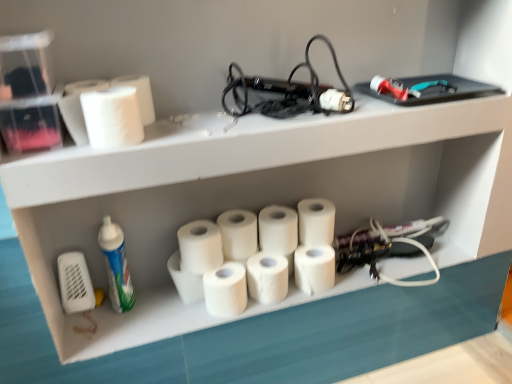
Describe the element at coordinates (78, 107) in the screenshot. This screenshot has height=384, width=512. I see `white matte toilet paper at upper left` at that location.

What do you see at coordinates (238, 234) in the screenshot?
I see `white matte paper towel at center, the 5th paper towel viewed from the right` at bounding box center [238, 234].

Locate an element on the screen. blue-green plastic cleaning product at lower left is located at coordinates (x=116, y=265).

Describe the element at coordinates (112, 117) in the screenshot. I see `white matte paper towel at upper left, which ranks as the 10th paper towel in right-to-left order` at that location.

The image size is (512, 384). Identify the location of white matte paper towel at center, the 5th paper towel from the left. (225, 290).

At what (x,y) coordinates should I click in order to perform the action: click on white matte toilet paper at upper left. Please return your answer as a coordinate pair (x, y). The image size is (512, 384). Looking at the image, I should click on (78, 107).

Is point (275, 293) farther from viewer compared to point (73, 82)?

Yes, point (275, 293) is farther from viewer.

Considering the relative sizes of white matte paper towel at center, the 4th paper towel positioned from the right, and white matte toilet paper at upper left in the image provided, is white matte paper towel at center, the 4th paper towel positioned from the right, smaller than white matte toilet paper at upper left?

Incorrect, white matte paper towel at center, the 4th paper towel positioned from the right, is not smaller in size than white matte toilet paper at upper left.

Do you think white matte paper towel at center, the 4th paper towel positioned from the right, is within white matte toilet paper at upper left, or outside of it?

white matte paper towel at center, the 4th paper towel positioned from the right, is not enclosed by white matte toilet paper at upper left.

There is a white matte toilet paper at upper left. Identify the location of the 7th paper towel below it (from a real-world perspective). (267, 277).

Consider the image. Can you confirm if white matte paper towel at center, the 5th paper towel from the left, is thinner than white matte paper towel at center, which is the 1th paper towel from right to left?

Yes, white matte paper towel at center, the 5th paper towel from the left, is thinner than white matte paper towel at center, which is the 1th paper towel from right to left.

Considering the sizes of objects white matte paper towel at center, the 5th paper towel from the left, and white matte paper towel at center, which is the 1th paper towel from right to left, in the image provided, who is taller, white matte paper towel at center, the 5th paper towel from the left, or white matte paper towel at center, which is the 1th paper towel from right to left,?

white matte paper towel at center, which is the 1th paper towel from right to left.

Is white matte paper towel at center, the 5th paper towel from the left, positioned in front of white matte paper towel at center, which is the 1th paper towel from right to left?

That is True.

Is white matte paper towel at center, which is the 1th paper towel from right to left, at the back of white matte paper towel at center, arranged as the sixth paper towel when viewed from the right?

No, white matte paper towel at center, which is the 1th paper towel from right to left, is not at the back of white matte paper towel at center, arranged as the sixth paper towel when viewed from the right.

Is white matte paper towel at center, the 5th paper towel from the left, to the left of white matte paper towel at center, the 9th paper towel from the left, from the viewer's perspective?

Correct, you'll find white matte paper towel at center, the 5th paper towel from the left, to the left of white matte paper towel at center, the 9th paper towel from the left.

Can you confirm if white matte paper towel at center, the 5th paper towel from the left, is smaller than white matte paper towel at center, the 9th paper towel from the left?

Correct, white matte paper towel at center, the 5th paper towel from the left, occupies less space than white matte paper towel at center, the 9th paper towel from the left.

Could you tell me if white matte paper towel at center, arranged as the sixth paper towel when viewed from the right, is turned towards white matte paper towel at center, which is counted as the 2th paper towel, starting from the right?

No.

Does white matte paper towel at center, arranged as the sixth paper towel when viewed from the right, lie in front of white matte paper towel at center, which is counted as the 2th paper towel, starting from the right?

Yes, white matte paper towel at center, arranged as the sixth paper towel when viewed from the right, is closer to the viewer.

Considering the positions of objects white matte toilet paper at upper left and white matte paper towel at center, the third paper towel when ordered from left to right, in the image provided, who is more to the left, white matte toilet paper at upper left or white matte paper towel at center, the third paper towel when ordered from left to right,?

From the viewer's perspective, white matte toilet paper at upper left appears more on the left side.

Are white matte toilet paper at upper left and white matte paper towel at center, the third paper towel when ordered from left to right, located far from each other?

No, there isn't a large distance between white matte toilet paper at upper left and white matte paper towel at center, the third paper towel when ordered from left to right.

The width and height of the screenshot is (512, 384). Find the location of `toilet paper that appears above the white matte paper towel at center, the third paper towel when ordered from left to right (from the image's perspective)`. toilet paper that appears above the white matte paper towel at center, the third paper towel when ordered from left to right (from the image's perspective) is located at coordinates (78, 107).

Consider the image. From a real-world perspective, does white matte toilet paper at upper left sit lower than white matte paper towel at center, the third paper towel when ordered from left to right?

No, from a real-world perspective, white matte toilet paper at upper left is not below white matte paper towel at center, the third paper towel when ordered from left to right.

Which of these two, white matte paper towel at upper left, which ranks as the 10th paper towel in right-to-left order, or blue-green plastic cleaning product at lower left, stands shorter?

white matte paper towel at upper left, which ranks as the 10th paper towel in right-to-left order.

What's the angular difference between white matte paper towel at upper left, which ranks as the 10th paper towel in right-to-left order, and blue-green plastic cleaning product at lower left's facing directions?

The angle between the facing direction of white matte paper towel at upper left, which ranks as the 10th paper towel in right-to-left order, and the facing direction of blue-green plastic cleaning product at lower left is 0.00115 degrees.

From the image's perspective, is white matte paper towel at upper left, arranged as the first paper towel when viewed from the left, located above or below blue-green plastic cleaning product at lower left?

Based on their image positions, white matte paper towel at upper left, arranged as the first paper towel when viewed from the left, is located above blue-green plastic cleaning product at lower left.

Is white matte paper towel at upper left, arranged as the first paper towel when viewed from the left, facing away from blue-green plastic cleaning product at lower left?

No, white matte paper towel at upper left, arranged as the first paper towel when viewed from the left,'s orientation is not away from blue-green plastic cleaning product at lower left.

Is white matte paper towel at upper left, which ranks as the 10th paper towel in right-to-left order, not near white matte toilet paper at upper left?

white matte paper towel at upper left, which ranks as the 10th paper towel in right-to-left order, is near white matte toilet paper at upper left, not far away.

Which is closer to the camera, (109, 121) or (79, 93)?

Point (109, 121) appears to be closer to the viewer than point (79, 93).

Which of these two, white matte paper towel at upper left, arranged as the first paper towel when viewed from the left, or white matte toilet paper at upper left, is bigger?

With larger size is white matte paper towel at upper left, arranged as the first paper towel when viewed from the left.

Could you tell me if white matte paper towel at upper left, which ranks as the 10th paper towel in right-to-left order, is turned towards white matte toilet paper at upper left?

No, white matte paper towel at upper left, which ranks as the 10th paper towel in right-to-left order, is not aimed at white matte toilet paper at upper left.

What's the angular difference between white matte toilet paper at upper left and white matte paper towel at center, the 5th paper towel from the left,'s facing directions?

The angular difference between white matte toilet paper at upper left and white matte paper towel at center, the 5th paper towel from the left, is 6.83e-05 degrees.

Identify the location of toilet paper lying in front of the white matte paper towel at center, the 5th paper towel from the left. (78, 107).

From a real-world perspective, between white matte toilet paper at upper left and white matte paper towel at center, arranged as the sixth paper towel when viewed from the right, who is vertically higher?

white matte toilet paper at upper left is physically above.

Looking at this image, is white matte toilet paper at upper left surrounding white matte paper towel at center, the 5th paper towel from the left?

No, white matte toilet paper at upper left does not contain white matte paper towel at center, the 5th paper towel from the left.

Starting from the white matte toilet paper at upper left, which paper towel is the 7th one to the right? Please provide its 2D coordinates.

[(267, 277)]

From the image's perspective, count 7th paper towels downward from the white matte paper towel at center, which is counted as the tenth paper towel, starting from the left, and point to it. Please provide its 2D coordinates.

[(225, 290)]

Estimate the real-world distances between objects in this image. Which object is further from white matte paper towel at center, the 5th paper towel from the left, white matte paper towel at center, which is the 1th paper towel from right to left, or blue-green plastic cleaning product at lower left?

white matte paper towel at center, which is the 1th paper towel from right to left, is positioned further to the anchor white matte paper towel at center, the 5th paper towel from the left.

Estimate the real-world distances between objects in this image. Which object is further from white matte paper towel at center, which appears as the eighth paper towel when viewed from the left, white matte paper towel at center, the 9th paper towel from the left, or white matte paper towel at center, which is counted as the tenth paper towel, starting from the left?

white matte paper towel at center, the 9th paper towel from the left, is further to white matte paper towel at center, which appears as the eighth paper towel when viewed from the left.

Which object lies further to the anchor point blue-green plastic cleaning product at lower left, white matte paper towel at center, arranged as the sixth paper towel when viewed from the right, or white matte paper towel at center, the third paper towel when ordered from left to right?

white matte paper towel at center, arranged as the sixth paper towel when viewed from the right, is further to blue-green plastic cleaning product at lower left.

Which object lies further to the anchor point white matte paper towel at center, which appears as the eighth paper towel when viewed from the left, white matte paper towel at center, acting as the 7th paper towel starting from the left, or white matte paper towel at center, the third paper towel when ordered from left to right?

white matte paper towel at center, the third paper towel when ordered from left to right.

Considering their positions, is blue-green plastic cleaning product at lower left positioned closer to white matte paper towel at center, which is counted as the 2th paper towel, starting from the right, than white matte paper towel at center, the sixth paper towel when ordered from left to right?

white matte paper towel at center, the sixth paper towel when ordered from left to right, lies closer to white matte paper towel at center, which is counted as the 2th paper towel, starting from the right, than the other object.

From the image, which object appears to be farther from white matte paper towel at upper left, arranged as the first paper towel when viewed from the left, white matte paper towel at center, arranged as the seventh paper towel when viewed from the right, or blue-green plastic cleaning product at lower left?

The object further to white matte paper towel at upper left, arranged as the first paper towel when viewed from the left, is blue-green plastic cleaning product at lower left.

From the image, which object appears to be farther from white matte paper towel at center, the 8th paper towel in the right-to-left sequence, white matte paper towel at center, arranged as the seventh paper towel when viewed from the right, or white matte paper towel at center, which is counted as the 2th paper towel, starting from the right?

Among the two, white matte paper towel at center, which is counted as the 2th paper towel, starting from the right, is located further to white matte paper towel at center, the 8th paper towel in the right-to-left sequence.

From the image, which object appears to be farther from white matte paper towel at upper left, which ranks as the 10th paper towel in right-to-left order, white matte paper towel at center, which is the 1th paper towel from right to left, or white matte paper towel at center, the 9th paper towel from the left?

white matte paper towel at center, the 9th paper towel from the left, is positioned further to the anchor white matte paper towel at upper left, which ranks as the 10th paper towel in right-to-left order.

Where is `toilet paper between white matte paper towel at upper left, the second paper towel positioned from the left, and blue-green plastic cleaning product at lower left from top to bottom`? Image resolution: width=512 pixels, height=384 pixels. toilet paper between white matte paper towel at upper left, the second paper towel positioned from the left, and blue-green plastic cleaning product at lower left from top to bottom is located at coordinates (78, 107).

The height and width of the screenshot is (384, 512). I want to click on toilet paper that lies between white matte paper towel at upper left, the second paper towel positioned from the left, and white matte paper towel at center, the 8th paper towel in the right-to-left sequence, from top to bottom, so click(x=78, y=107).

Find the location of a particular element. This screenshot has width=512, height=384. cleaning product between white matte paper towel at upper left, the second paper towel positioned from the left, and white matte paper towel at center, the 8th paper towel in the right-to-left sequence, in the up-down direction is located at coordinates (116, 265).

Identify the location of paper towel between white matte paper towel at center, the 8th paper towel in the right-to-left sequence, and white matte paper towel at center, the 5th paper towel from the left. (200, 247).